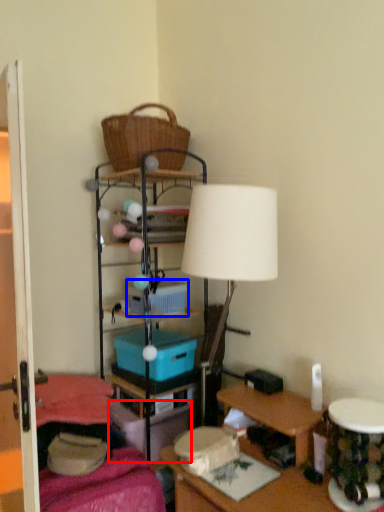
Question: Which of the following is the closest to the observer, storage box (highlighted by a red box) or storage box (highlighted by a blue box)?

Choices:
 (A) storage box
 (B) storage box

Answer: (A)